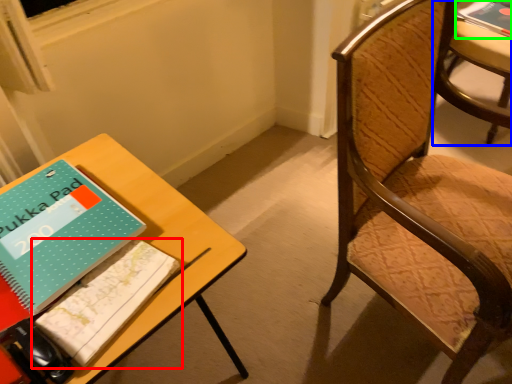
Question: Which is nearer to the book (highlighted by a red box)? chair (highlighted by a blue box) or book (highlighted by a green box).

Choices:
 (A) chair
 (B) book

Answer: (A)